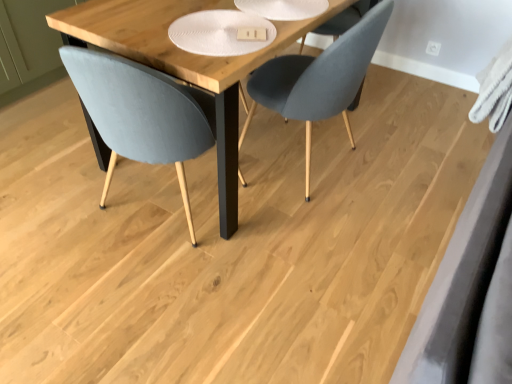
The height and width of the screenshot is (384, 512). What are the coordinates of `free point to the right of velvet grey chair at center, the first chair in the right-to-left sequence` in the screenshot? It's located at (400, 168).